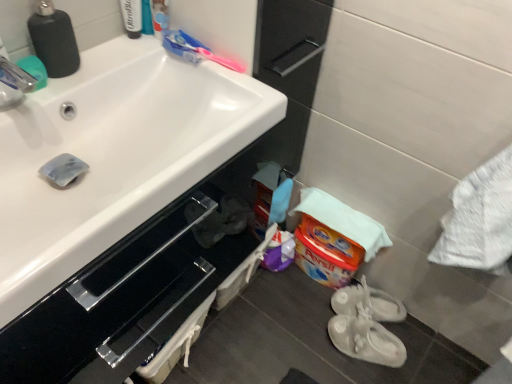
Locate an element on the screen. This screenshot has width=512, height=384. vacant area that lies to the right of white glossy tube at upper left, the first toiletry positioned from the left is located at coordinates (182, 56).